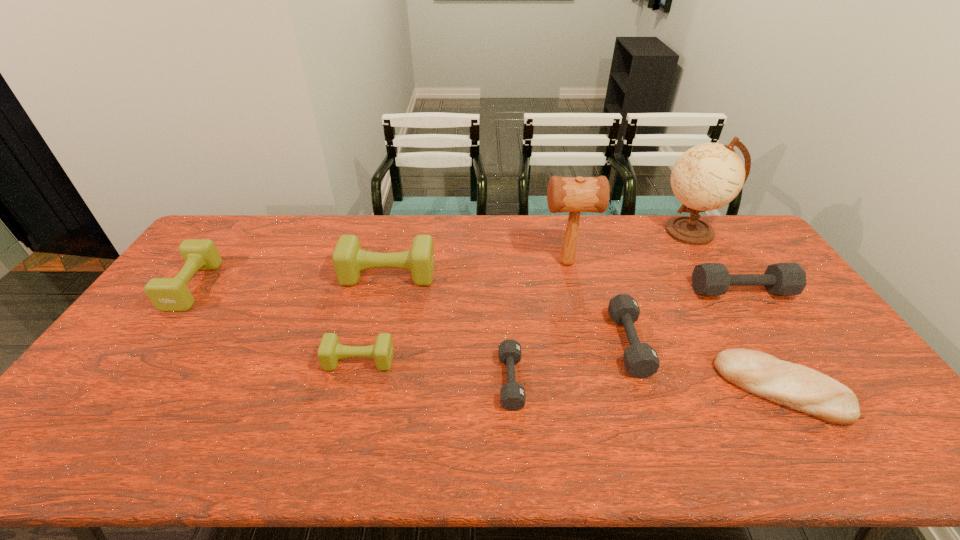
I want to click on free space between the third tallest object and the bread, so click(x=585, y=332).

Where is `vacant point located between the bread and the biggest gray dumbbell`? The width and height of the screenshot is (960, 540). vacant point located between the bread and the biggest gray dumbbell is located at coordinates (761, 340).

I want to click on vacant space that's between the rightmost gray dumbbell and the fifth dumbbell from left to right, so click(685, 318).

Point out which object is positioned as the eighth nearest to the second biggest gray dumbbell. Please provide its 2D coordinates. Your answer should be formatted as a tuple, i.e. [(x, y)], where the tuple contains the x and y coordinates of a point satisfying the conditions above.

[(167, 294)]

Identify which object is located as the second nearest to the biggest olive dumbbell. Please provide its 2D coordinates. Your answer should be formatted as a tuple, i.e. [(x, y)], where the tuple contains the x and y coordinates of a point satisfying the conditions above.

[(512, 395)]

Locate an element on the screen. The height and width of the screenshot is (540, 960). dumbbell that is the third nearest to the third tallest object is located at coordinates (167, 294).

At what (x,y) coordinates should I click in order to perform the action: click on the fifth closest dumbbell relative to the mallet. Please return your answer as a coordinate pair (x, y). The width and height of the screenshot is (960, 540). Looking at the image, I should click on (330, 350).

Find the location of `olive dumbbell that can be found as the closest to the rightmost gray dumbbell`. olive dumbbell that can be found as the closest to the rightmost gray dumbbell is located at coordinates tap(349, 260).

Identify which olive dumbbell is the second nearest to the farthest gray dumbbell. Please provide its 2D coordinates. Your answer should be formatted as a tuple, i.e. [(x, y)], where the tuple contains the x and y coordinates of a point satisfying the conditions above.

[(330, 350)]

Choose which gray dumbbell is the third nearest neighbor to the nearest olive dumbbell. Please provide its 2D coordinates. Your answer should be formatted as a tuple, i.e. [(x, y)], where the tuple contains the x and y coordinates of a point satisfying the conditions above.

[(708, 279)]